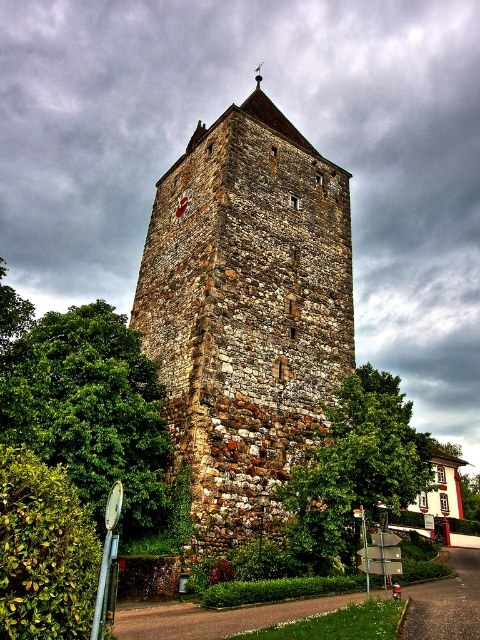
Question: From the image, what is the correct spatial relationship of green leafy tree at left in relation to green leafy tree at center?

Choices:
 (A) right
 (B) left

Answer: (B)

Question: Is rustic stone tower at center wider than green leafy tree at left?

Choices:
 (A) no
 (B) yes

Answer: (B)

Question: Which object is positioned farthest from the rustic stone tower at center?

Choices:
 (A) green leafy tree at center
 (B) green leafy tree at left

Answer: (A)

Question: Which point is closer to the camera?

Choices:
 (A) (68, 461)
 (B) (240, 403)

Answer: (A)

Question: Is rustic stone tower at center bigger than green leafy tree at left?

Choices:
 (A) no
 (B) yes

Answer: (B)

Question: Which object is farther from the camera taking this photo?

Choices:
 (A) green leafy tree at center
 (B) green leafy tree at left

Answer: (A)